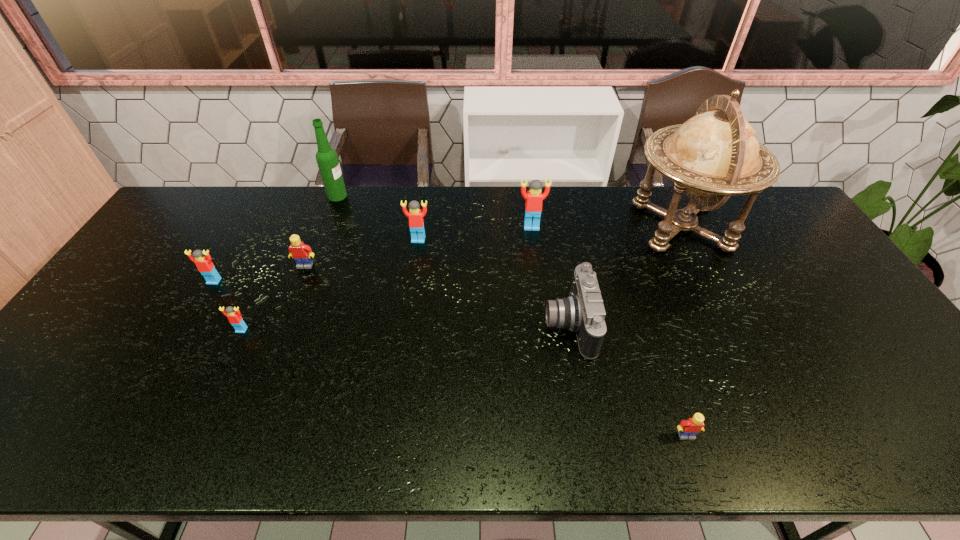
What are the coordinates of `empty space that is in between the farthest red Lego and the leftmost Lego` in the screenshot? It's located at [x=372, y=254].

Where is `vacant area that lies between the third biggest red Lego and the second tallest object`? This screenshot has width=960, height=540. vacant area that lies between the third biggest red Lego and the second tallest object is located at coordinates (276, 239).

The height and width of the screenshot is (540, 960). What are the coordinates of `empty location between the nearest object and the leftmost red Lego` in the screenshot? It's located at (450, 359).

You are a GUI agent. You are given a task and a screenshot of the screen. Output one action in this format:
    pyautogui.click(x=<x>, y=<y>)
    Task: Click on the vacant area that lies between the fifth Lego from right to left and the fourth nearest Lego
    The height and width of the screenshot is (540, 960).
    Given the screenshot: What is the action you would take?
    pyautogui.click(x=274, y=298)

The width and height of the screenshot is (960, 540). Identify the location of empty space that is in between the globe and the rightmost Lego. (684, 331).

What are the coordinates of `empty space between the leftmost Lego and the smallest red Lego` in the screenshot? It's located at (228, 306).

At what (x,y) coordinates should I click in order to perform the action: click on free area in between the fifth object from left to right and the globe. Please return your answer as a coordinate pair (x, y). Looking at the image, I should click on (550, 233).

You are a GUI agent. You are given a task and a screenshot of the screen. Output one action in this format:
    pyautogui.click(x=<x>, y=<y>)
    Task: Click on the object that is the second closest one to the green beer bottle
    Image resolution: width=960 pixels, height=540 pixels.
    Given the screenshot: What is the action you would take?
    pyautogui.click(x=302, y=253)

The image size is (960, 540). What are the coordinates of `object that is the seventh nearest to the farther yellow Lego` in the screenshot? It's located at (715, 154).

Identify the location of Lego that stands as the second closest to the second object from left to right. The width and height of the screenshot is (960, 540). coord(302,253).